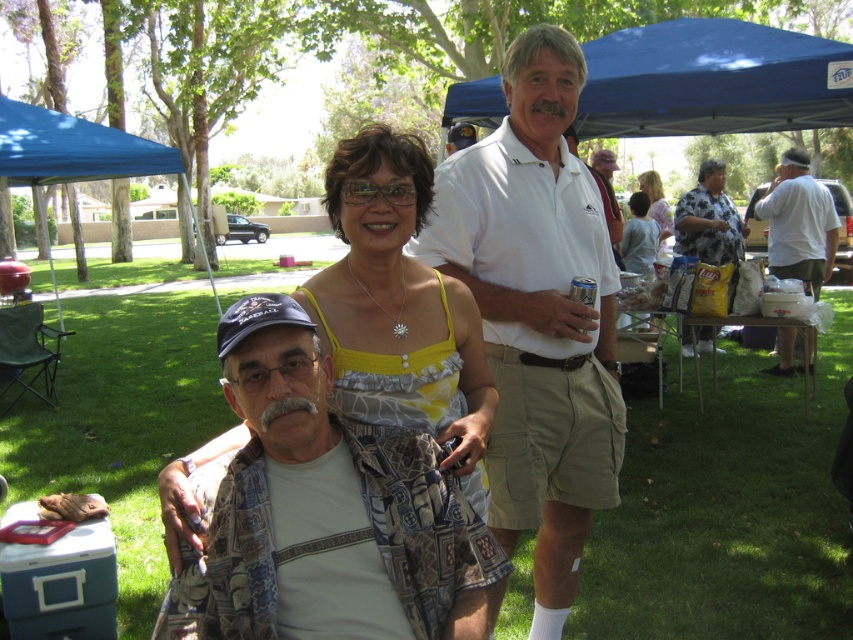
Question: Is white cotton polo shirt at center in front of white cotton shirt at center?

Choices:
 (A) no
 (B) yes

Answer: (B)

Question: Which object is closer to the camera taking this photo?

Choices:
 (A) floral shirt at right
 (B) blue fabric canopy at upper center
 (C) blue fabric canopy at upper left
 (D) white cotton polo shirt at center

Answer: (D)

Question: Which point appears farthest from the camera in this image?

Choices:
 (A) (364, 308)
 (B) (683, 243)

Answer: (B)

Question: Does white cotton polo shirt at center lie behind white cotton shirt at center?

Choices:
 (A) no
 (B) yes

Answer: (A)

Question: Is yellow fabric dress at center above blue fabric canopy at upper left?

Choices:
 (A) yes
 (B) no

Answer: (B)

Question: Which point is farther to the camera?

Choices:
 (A) (822, 259)
 (B) (28, 131)

Answer: (A)